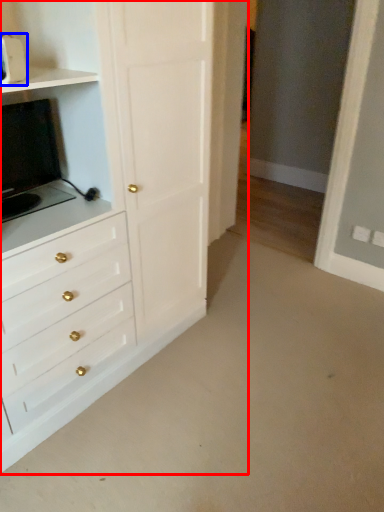
Question: Among these objects, which one is nearest to the camera, chest of drawers (highlighted by a red box) or appliance (highlighted by a blue box)?

Choices:
 (A) chest of drawers
 (B) appliance

Answer: (A)